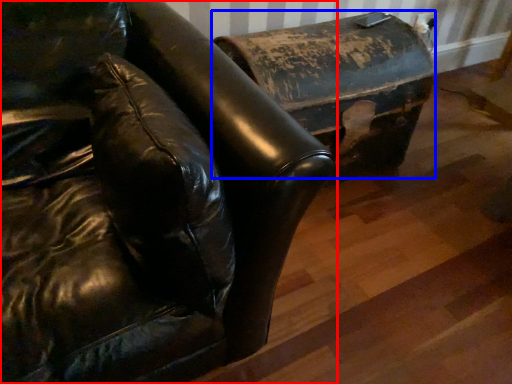
Question: Which of the following is the closest to the observer, furniture (highlighted by a red box) or furniture (highlighted by a blue box)?

Choices:
 (A) furniture
 (B) furniture

Answer: (A)